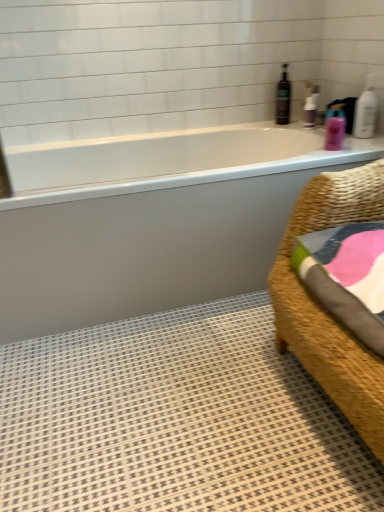
Question: Considering the relative sizes of white glossy bathtub at upper center and brown glass bottle at upper right in the image provided, is white glossy bathtub at upper center smaller than brown glass bottle at upper right?

Choices:
 (A) yes
 (B) no

Answer: (B)

Question: From a real-world perspective, is white glossy bathtub at upper center on top of brown glass bottle at upper right?

Choices:
 (A) no
 (B) yes

Answer: (A)

Question: Is the depth of white glossy bathtub at upper center less than that of brown glass bottle at upper right?

Choices:
 (A) no
 (B) yes

Answer: (B)

Question: Is white glossy bathtub at upper center positioned beyond the bounds of brown glass bottle at upper right?

Choices:
 (A) no
 (B) yes

Answer: (B)

Question: Can you confirm if white glossy bathtub at upper center is positioned to the left of brown glass bottle at upper right?

Choices:
 (A) no
 (B) yes

Answer: (B)

Question: Would you say white plastic pump at upper right, the second toiletry when ordered from front to back, is to the left or to the right of white glossy bathtub at upper center in the picture?

Choices:
 (A) right
 (B) left

Answer: (A)

Question: Is point pyautogui.click(x=311, y=96) positioned closer to the camera than point pyautogui.click(x=157, y=154)?

Choices:
 (A) closer
 (B) farther

Answer: (B)

Question: From their relative heights in the image, would you say white plastic pump at upper right, acting as the first toiletry starting from the back, is taller or shorter than white glossy bathtub at upper center?

Choices:
 (A) short
 (B) tall

Answer: (A)

Question: Is white plastic pump at upper right, acting as the first toiletry starting from the back, wider or thinner than white glossy bathtub at upper center?

Choices:
 (A) thin
 (B) wide

Answer: (A)

Question: Considering the positions of white glossy bathtub at upper center and white plastic pump at upper right, the 1th toiletry positioned from the top, in the image, is white glossy bathtub at upper center bigger or smaller than white plastic pump at upper right, the 1th toiletry positioned from the top,?

Choices:
 (A) small
 (B) big

Answer: (B)

Question: Considering the relative positions of white glossy bathtub at upper center and white plastic pump at upper right, acting as the first toiletry starting from the back, in the image provided, is white glossy bathtub at upper center to the left or to the right of white plastic pump at upper right, acting as the first toiletry starting from the back,?

Choices:
 (A) right
 (B) left

Answer: (B)

Question: From their relative heights in the image, would you say white glossy bathtub at upper center is taller or shorter than white plastic pump at upper right, the 1th toiletry positioned from the top?

Choices:
 (A) short
 (B) tall

Answer: (B)

Question: From the image's perspective, is white glossy bathtub at upper center located above or below white plastic pump at upper right, the 1th toiletry positioned from the top?

Choices:
 (A) above
 (B) below

Answer: (B)

Question: Considering the positions of point (278, 82) and point (102, 292), is point (278, 82) closer or farther from the camera than point (102, 292)?

Choices:
 (A) farther
 (B) closer

Answer: (A)

Question: From the image's perspective, is brown glass bottle at upper right positioned above or below white glossy bathtub at upper center?

Choices:
 (A) above
 (B) below

Answer: (A)